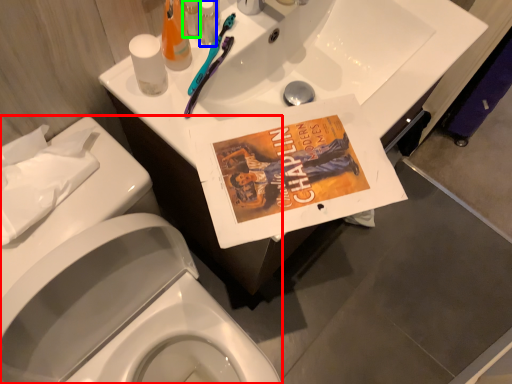
Question: Estimate the real-world distances between objects in this image. Which object is farther from porcelain (highlighted by a red box), toiletry (highlighted by a blue box) or toiletry (highlighted by a green box)?

Choices:
 (A) toiletry
 (B) toiletry

Answer: (A)